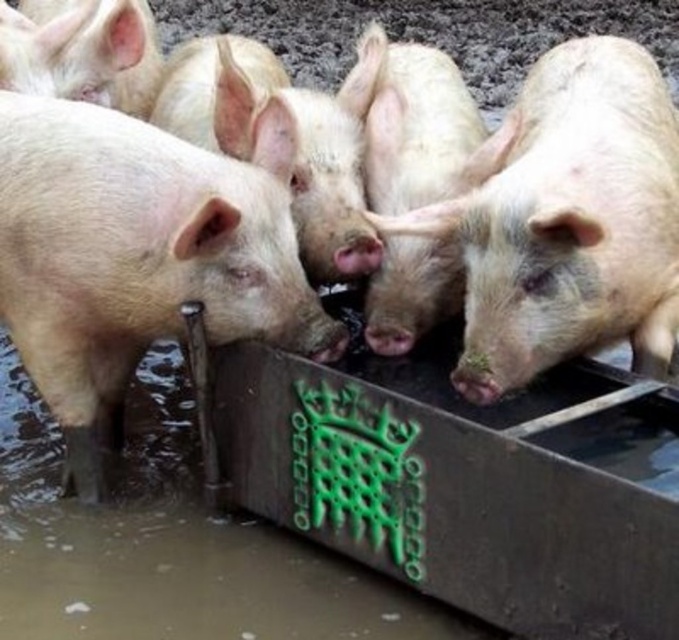
Question: Is pink matte pig at center positioned at the back of pink matte piglet at center?

Choices:
 (A) yes
 (B) no

Answer: (A)

Question: Among these objects, which one is nearest to the camera?

Choices:
 (A) pink matte piglet at center
 (B) pink matte pig at center

Answer: (A)

Question: Does pink matte pig at center appear on the left side of pink matte piglet at center?

Choices:
 (A) yes
 (B) no

Answer: (A)

Question: Where is pink matte pig at center located in relation to pink matte piglet at center in the image?

Choices:
 (A) left
 (B) right

Answer: (A)